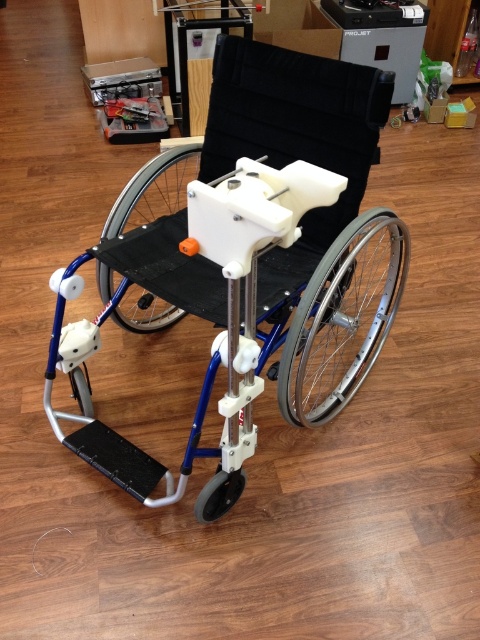
You are a caregiver trying to move the silver metallic wheelchair at center to a different room. The black rubber wheel at lower center is blocking the doorway. Can you lift the wheelchair over the wheel without moving the wheel itself?

The silver metallic wheelchair at center is located above black rubber wheel at lower center, so you can lift the wheelchair over the wheel since it is already positioned higher than the wheel.